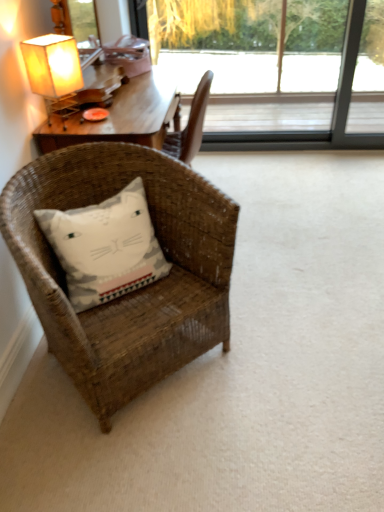
Describe the element at coordinates (105, 247) in the screenshot. I see `white cotton pillow with cat design at lower left` at that location.

What do you see at coordinates (52, 65) in the screenshot? I see `matte paper lampshade at upper left` at bounding box center [52, 65].

What do you see at coordinates (135, 291) in the screenshot? The height and width of the screenshot is (512, 384). I see `woven brown chair at lower left` at bounding box center [135, 291].

Find the location of a particular element. The height and width of the screenshot is (512, 384). white cotton pillow with cat design at lower left is located at coordinates (105, 247).

Based on the photo, between matte paper lampshade at upper left and woven brown chair at lower left, which one has larger width?

Wider between the two is woven brown chair at lower left.

Between matte paper lampshade at upper left and woven brown chair at lower left, which one is positioned in front?

woven brown chair at lower left is more forward.

In the scene shown: Would you say matte paper lampshade at upper left contains woven brown chair at lower left?

That's incorrect, woven brown chair at lower left is not inside matte paper lampshade at upper left.

Visually, is matte paper lampshade at upper left positioned to the left or to the right of woven brown chair at lower left?

matte paper lampshade at upper left is to the left of woven brown chair at lower left.

Would you say woven brown chair at lower left is to the left or to the right of transparent glass window at upper center in the picture?

woven brown chair at lower left is to the left of transparent glass window at upper center.

Is point (181, 197) in front of point (343, 21)?

Yes.

From a real-world perspective, is woven brown chair at lower left positioned above or below transparent glass window at upper center?

In terms of real-world spatial position, woven brown chair at lower left is below transparent glass window at upper center.

Considering the relative sizes of white cotton pillow with cat design at lower left and matte paper lampshade at upper left in the image provided, is white cotton pillow with cat design at lower left wider than matte paper lampshade at upper left?

Correct, the width of white cotton pillow with cat design at lower left exceeds that of matte paper lampshade at upper left.

Can you confirm if white cotton pillow with cat design at lower left is taller than matte paper lampshade at upper left?

In fact, white cotton pillow with cat design at lower left may be shorter than matte paper lampshade at upper left.

How different are the orientations of white cotton pillow with cat design at lower left and matte paper lampshade at upper left in degrees?

The angle between the facing direction of white cotton pillow with cat design at lower left and the facing direction of matte paper lampshade at upper left is 107 degrees.

Can you confirm if white cotton pillow with cat design at lower left is wider than transparent glass window at upper center?

Yes, white cotton pillow with cat design at lower left is wider than transparent glass window at upper center.

How many degrees apart are the facing directions of white cotton pillow with cat design at lower left and transparent glass window at upper center?

The facing directions of white cotton pillow with cat design at lower left and transparent glass window at upper center are 42.3 degrees apart.

Between white cotton pillow with cat design at lower left and transparent glass window at upper center, which one has less height?

white cotton pillow with cat design at lower left is shorter.

Identify the location of window above the white cotton pillow with cat design at lower left (from the image's perspective). This screenshot has width=384, height=512. (275, 69).

From a real-world perspective, relative to woven brown chair at lower left, is transparent glass window at upper center vertically above or below?

transparent glass window at upper center is situated higher than woven brown chair at lower left in the real world.

Could you tell me if transparent glass window at upper center is turned towards woven brown chair at lower left?

Yes, transparent glass window at upper center is facing woven brown chair at lower left.

Is the depth of transparent glass window at upper center greater than that of woven brown chair at lower left?

Yes, it is behind woven brown chair at lower left.

Where is `chair on the left of transparent glass window at upper center`? The width and height of the screenshot is (384, 512). chair on the left of transparent glass window at upper center is located at coordinates (135, 291).

Considering their positions, is matte paper lampshade at upper left located in front of or behind white cotton pillow with cat design at lower left?

Clearly, matte paper lampshade at upper left is behind white cotton pillow with cat design at lower left.

Is matte paper lampshade at upper left turned away from white cotton pillow with cat design at lower left?

matte paper lampshade at upper left is not turned away from white cotton pillow with cat design at lower left.

From a real-world perspective, which is physically below, matte paper lampshade at upper left or white cotton pillow with cat design at lower left?

In real-world perspective, white cotton pillow with cat design at lower left is lower.

Based on the photo, is white cotton pillow with cat design at lower left a part of matte paper lampshade at upper left?

No, white cotton pillow with cat design at lower left is located outside of matte paper lampshade at upper left.

Which is more to the left, white cotton pillow with cat design at lower left or woven brown chair at lower left?

white cotton pillow with cat design at lower left.

Is white cotton pillow with cat design at lower left positioned beyond the bounds of woven brown chair at lower left?

Answer: No, white cotton pillow with cat design at lower left is not entirely external to woven brown chair at lower left.

Is the depth of white cotton pillow with cat design at lower left less than that of woven brown chair at lower left?

No, white cotton pillow with cat design at lower left is behind woven brown chair at lower left.

I want to click on pillow above the woven brown chair at lower left (from the image's perspective), so click(x=105, y=247).

Image resolution: width=384 pixels, height=512 pixels. I want to click on chair that appears below the matte paper lampshade at upper left (from a real-world perspective), so click(135, 291).

This screenshot has width=384, height=512. In order to click on window located above the woven brown chair at lower left (from the image's perspective) in this screenshot , I will do `click(275, 69)`.

Estimate the real-world distances between objects in this image. Which object is closer to woven brown chair at lower left, transparent glass window at upper center or matte paper lampshade at upper left?

Based on the image, matte paper lampshade at upper left appears to be nearer to woven brown chair at lower left.

Considering their positions, is white cotton pillow with cat design at lower left positioned closer to matte paper lampshade at upper left than transparent glass window at upper center?

white cotton pillow with cat design at lower left is positioned closer to the anchor matte paper lampshade at upper left.

Which object lies nearer to the anchor point white cotton pillow with cat design at lower left, woven brown chair at lower left or transparent glass window at upper center?

Based on the image, woven brown chair at lower left appears to be nearer to white cotton pillow with cat design at lower left.

Estimate the real-world distances between objects in this image. Which object is closer to transparent glass window at upper center, white cotton pillow with cat design at lower left or matte paper lampshade at upper left?

The object closer to transparent glass window at upper center is matte paper lampshade at upper left.

Considering their positions, is woven brown chair at lower left positioned closer to transparent glass window at upper center than white cotton pillow with cat design at lower left?

Based on the image, woven brown chair at lower left appears to be nearer to transparent glass window at upper center.

When comparing their distances from matte paper lampshade at upper left, does white cotton pillow with cat design at lower left or woven brown chair at lower left seem further?

Based on the image, woven brown chair at lower left appears to be further to matte paper lampshade at upper left.

When comparing their distances from white cotton pillow with cat design at lower left, does transparent glass window at upper center or matte paper lampshade at upper left seem further?

transparent glass window at upper center is positioned further to the anchor white cotton pillow with cat design at lower left.

Which object lies nearer to the anchor point matte paper lampshade at upper left, transparent glass window at upper center or woven brown chair at lower left?

The object closer to matte paper lampshade at upper left is woven brown chair at lower left.

Where is `pillow between matte paper lampshade at upper left and woven brown chair at lower left in the up-down direction`? This screenshot has width=384, height=512. pillow between matte paper lampshade at upper left and woven brown chair at lower left in the up-down direction is located at coordinates (105, 247).

Find the location of a particular element. The width and height of the screenshot is (384, 512). lamp between white cotton pillow with cat design at lower left and transparent glass window at upper center from front to back is located at coordinates (52, 65).

At what (x,y) coordinates should I click in order to perform the action: click on pillow between woven brown chair at lower left and transparent glass window at upper center along the z-axis. Please return your answer as a coordinate pair (x, y). The width and height of the screenshot is (384, 512). Looking at the image, I should click on (105, 247).

This screenshot has height=512, width=384. In order to click on lamp positioned between woven brown chair at lower left and transparent glass window at upper center from near to far in this screenshot , I will do tap(52, 65).